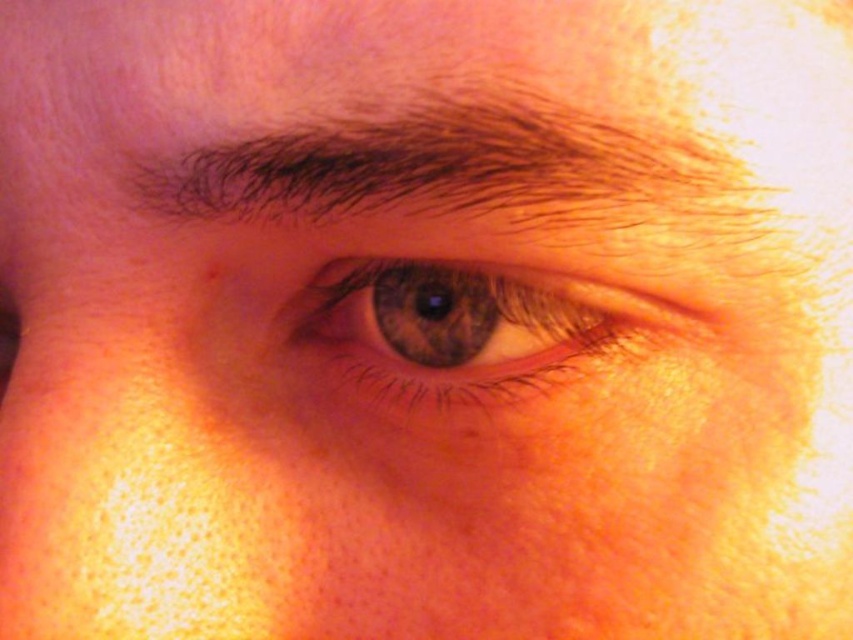
From the picture: Is dark brown hair at upper center bigger than brown matte freckle at upper left?

Indeed, dark brown hair at upper center has a larger size compared to brown matte freckle at upper left.

Does point (373, 116) lie in front of point (209, 266)?

Yes, it is in front of point (209, 266).

Where is `dark brown hair at upper center`? The width and height of the screenshot is (853, 640). dark brown hair at upper center is located at coordinates (474, 168).

Is brown matte eye at center to the left of brown matte freckle at upper left from the viewer's perspective?

In fact, brown matte eye at center is to the right of brown matte freckle at upper left.

Locate an element on the screen. brown matte eye at center is located at coordinates (474, 330).

The height and width of the screenshot is (640, 853). Describe the element at coordinates (474, 330) in the screenshot. I see `brown matte eye at center` at that location.

Where is `brown matte eye at center`? brown matte eye at center is located at coordinates (474, 330).

Based on the photo, is dark brown hair at upper center bigger than brown matte eye at center?

Yes.

Is dark brown hair at upper center further to camera compared to brown matte eye at center?

No, dark brown hair at upper center is closer to the viewer.

Is point (267, 186) positioned before point (640, 340)?

Yes, it is.

Find the location of `dark brown hair at upper center`. dark brown hair at upper center is located at coordinates (474, 168).